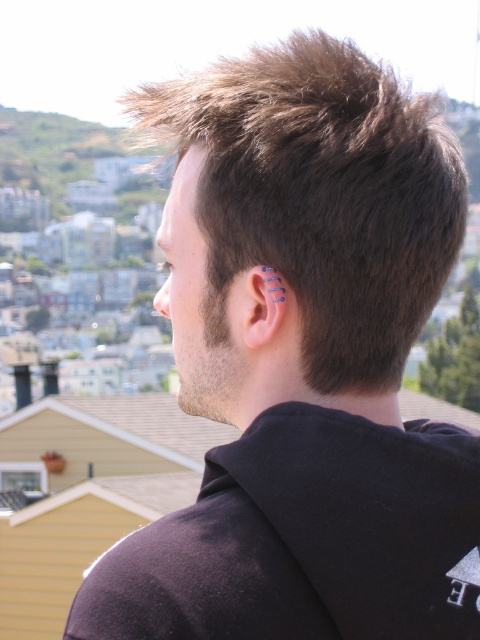
Question: Which of the following is the closest to the observer?

Choices:
 (A) black cotton sweatshirt at upper center
 (B) blue metallic ear at center

Answer: (A)

Question: Does black cotton sweatshirt at upper center have a larger size compared to blue metallic ear at center?

Choices:
 (A) no
 (B) yes

Answer: (B)

Question: Does dark brown hair at upper center appear on the right side of blue metallic ear at center?

Choices:
 (A) no
 (B) yes

Answer: (B)

Question: Which of the following is the closest to the observer?

Choices:
 (A) blue metallic ear at center
 (B) dark brown hair at upper center

Answer: (B)

Question: Does dark brown hair at upper center appear under black cotton sweatshirt at upper center?

Choices:
 (A) yes
 (B) no

Answer: (B)

Question: Which point is farther from the camera taking this photo?

Choices:
 (A) (276, 305)
 (B) (165, 579)
 (C) (303, 198)

Answer: (A)